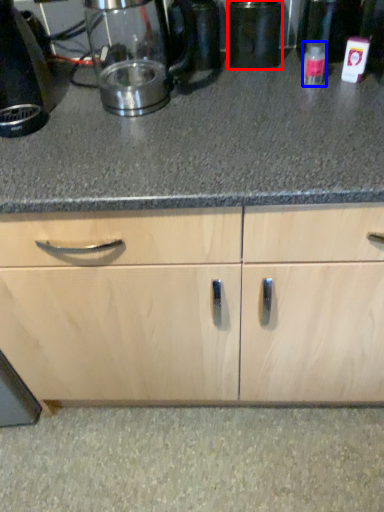
Question: Which of the following is the closest to the observer, appliance (highlighted by a red box) or bottle (highlighted by a blue box)?

Choices:
 (A) appliance
 (B) bottle

Answer: (B)